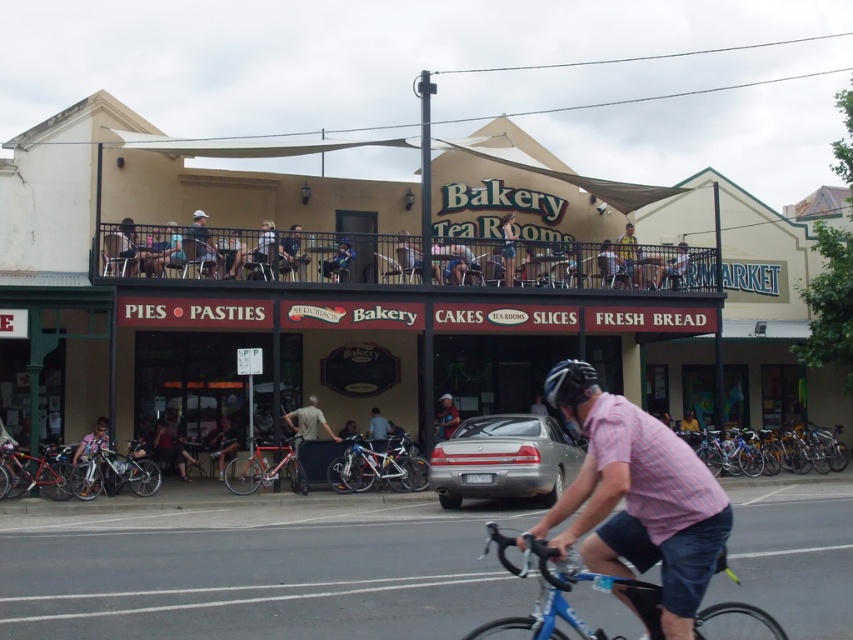
You are a delivery person who needs to choose a helmet that fits through a narrow alleyway between the two shops. The alley is only wide enough for a helmet that is not wider than 20 cm. You have the white matte bicycle helmet at center and the dark gray helmet at upper center. Which helmet should you choose?

The white matte bicycle helmet at center might be wider than dark gray helmet at upper center, so you should choose the dark gray helmet at upper center to ensure it fits through the narrow alleyway.

You are a customer waiting to be seated at the bakery and tea room. You notice two people in the seating area wearing the plaid shirt at center and the yellow fabric shirt at upper center. Which customer is closer to you?

The plaid shirt at center is larger in size than the yellow fabric shirt at upper center, so the customer wearing the plaid shirt at center is closer to you.

You are a customer standing at the entrance of the Bakery Tea Rooms. You see a person wearing a dark blue shirt at upper center and another wearing a matte blue helmet at center. Which person is closer to your left side?

The dark blue shirt at upper center is to the left of the matte blue helmet at center, so the person wearing the dark blue shirt at upper center is closer to your left side.